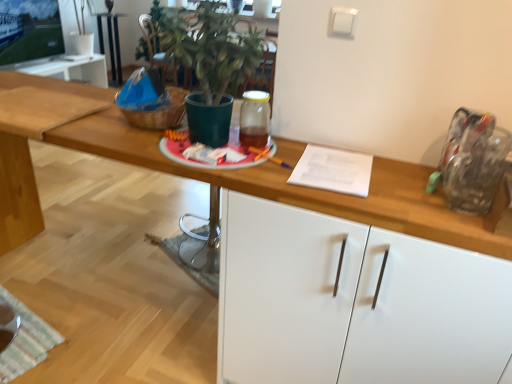
Where is `free space above white glossy cabinet at center (from a real-world perspective)`? The width and height of the screenshot is (512, 384). free space above white glossy cabinet at center (from a real-world perspective) is located at coordinates (369, 182).